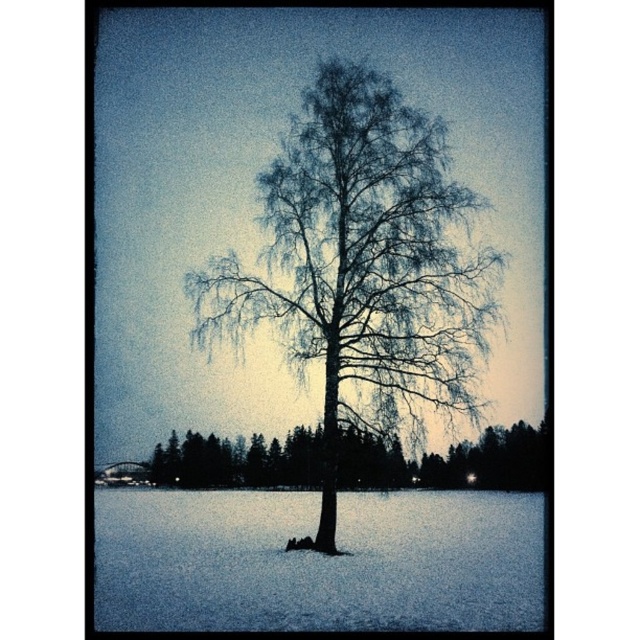
Question: Among these objects, which one is farthest from the camera?

Choices:
 (A) bare branches at center
 (B) snowy bark tree at center

Answer: (B)

Question: Which point is closer to the camera?

Choices:
 (A) (307, 442)
 (B) (470, 384)

Answer: (B)

Question: From the image, what is the correct spatial relationship of bare branches at center in relation to snowy bark tree at center?

Choices:
 (A) right
 (B) left

Answer: (B)

Question: Is bare branches at center below snowy bark tree at center?

Choices:
 (A) yes
 (B) no

Answer: (B)

Question: Which object appears closest to the camera in this image?

Choices:
 (A) bare branches at center
 (B) snowy bark tree at center

Answer: (A)

Question: Is bare branches at center below snowy bark tree at center?

Choices:
 (A) yes
 (B) no

Answer: (B)